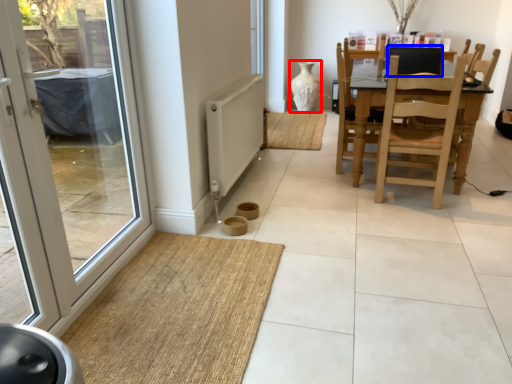
Question: Which object is closer to the camera taking this photo, vase (highlighted by a red box) or back (highlighted by a blue box)?

Choices:
 (A) vase
 (B) back

Answer: (B)